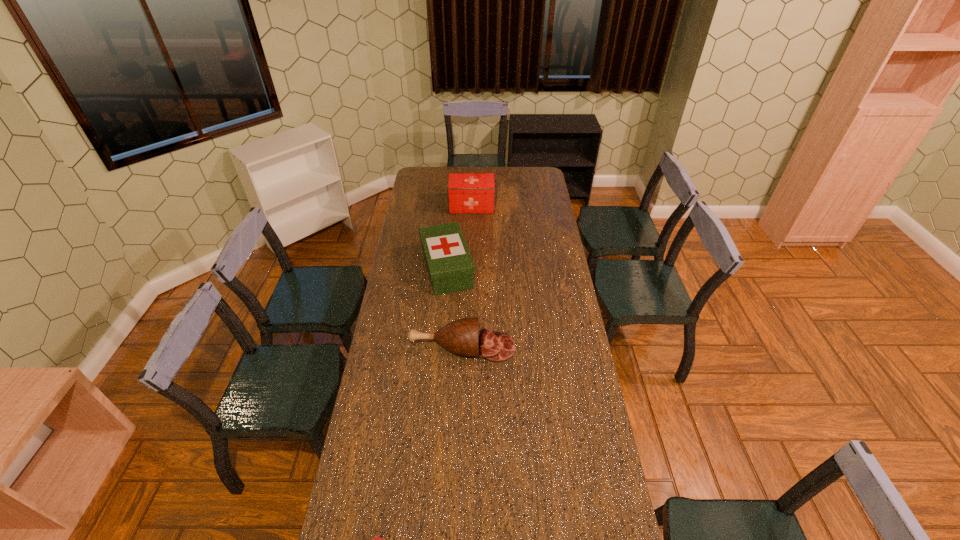
This screenshot has width=960, height=540. Identify the location of the farthest object. (468, 193).

Locate an element on the screen. the tallest object is located at coordinates (468, 193).

Image resolution: width=960 pixels, height=540 pixels. I want to click on the second nearest object, so click(x=460, y=336).

This screenshot has width=960, height=540. I want to click on the second farthest object, so click(x=450, y=266).

Locate an element on the screen. The image size is (960, 540). the second nearest first-aid kit is located at coordinates (450, 266).

Identify the location of vacant space located 0.170m on the handle side of the farthest first-aid kit. (525, 206).

Where is `vacant position located 0.100m at the sliced end of the third farthest object`? vacant position located 0.100m at the sliced end of the third farthest object is located at coordinates (540, 348).

Where is `vacant region located on the front of the second tallest first-aid kit`? vacant region located on the front of the second tallest first-aid kit is located at coordinates (441, 345).

I want to click on ham positioned at the left edge, so click(x=460, y=336).

Image resolution: width=960 pixels, height=540 pixels. Identify the location of the first-aid kit that is positioned at the left edge. tap(450, 266).